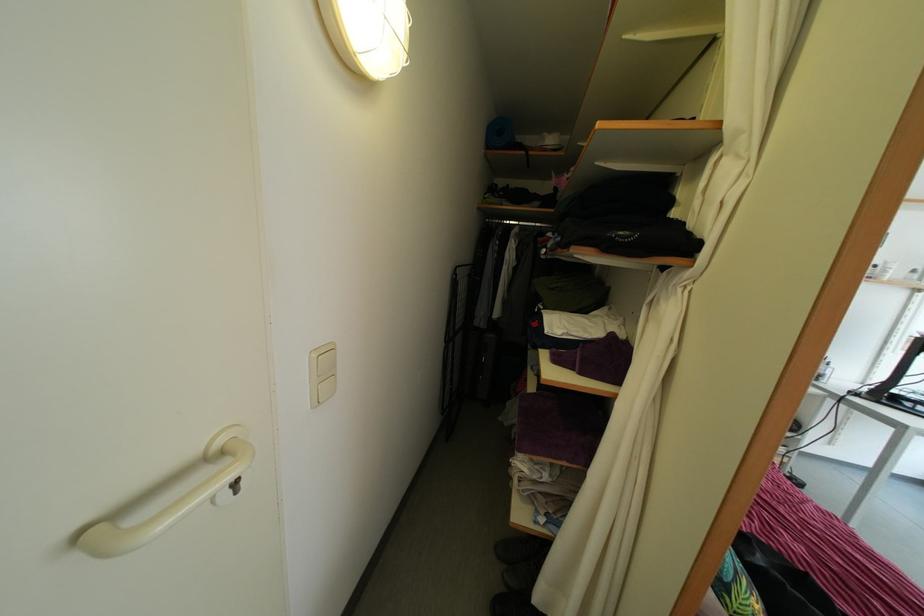
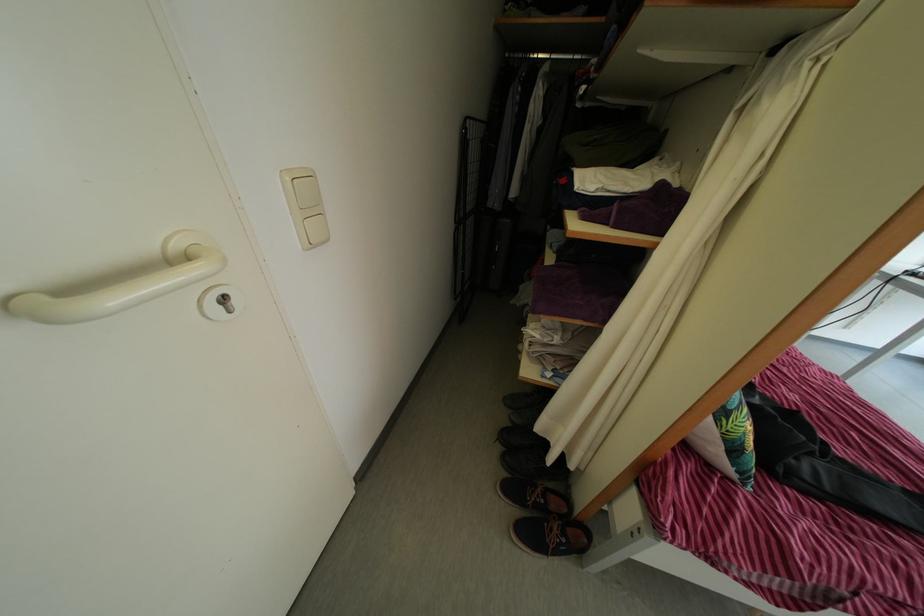
Locate, in the second image, the point that corresponds to pixel 249 491 in the first image.

(239, 310)